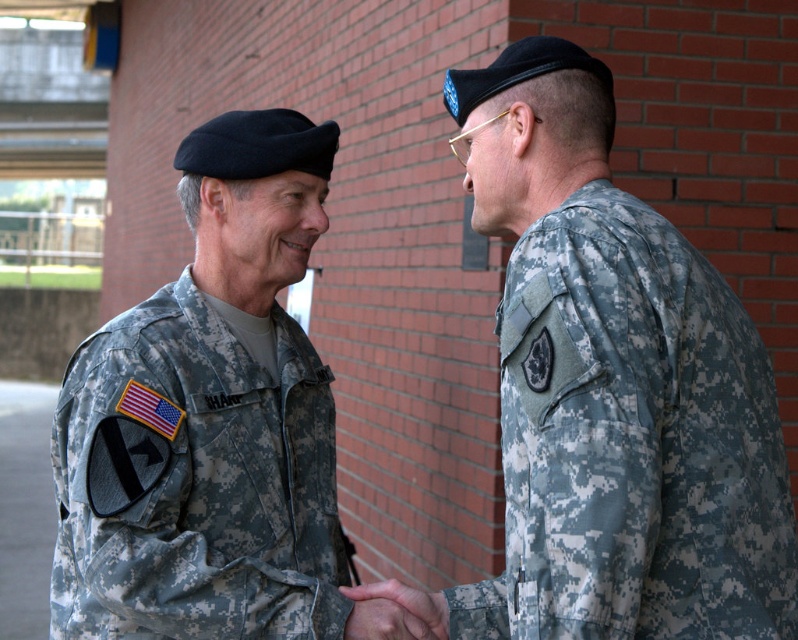
You are a photographer trying to capture a clear photo of the camouflage uniform at right and the camouflage fabric uniform at left. Since both are wearing camouflage, which one should you focus on to ensure it appears more prominent in the photo?

The camouflage uniform at right is in front of the camouflage fabric uniform at left, so focusing on it would make it appear more prominent.